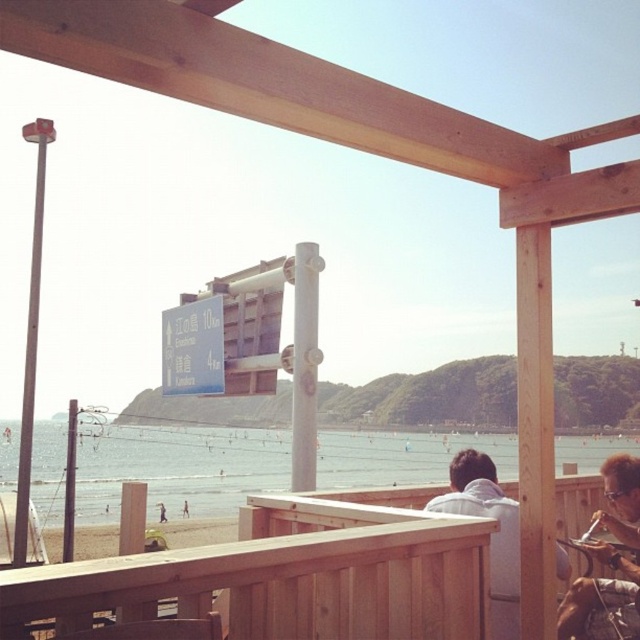
Question: Which point is farther from the camera taking this photo?

Choices:
 (A) (164, 522)
 (B) (502, 556)
 (C) (570, 632)
 (D) (252, 472)

Answer: (D)

Question: Can you confirm if white matte shirt at lower right is positioned below tan skin person at lower center?

Choices:
 (A) no
 (B) yes

Answer: (A)

Question: Which point is farther to the camera?

Choices:
 (A) (173, 488)
 (B) (611, 627)

Answer: (A)

Question: From the image, what is the correct spatial relationship of matte brown hair at upper right in relation to white matte shirt at lower right?

Choices:
 (A) above
 (B) below

Answer: (B)

Question: Does white matte shirt at lower right have a lesser width compared to tan skin person at lower center?

Choices:
 (A) yes
 (B) no

Answer: (B)

Question: Considering the real-world distances, which object is farthest from the tan skin person at lower center?

Choices:
 (A) dark brown wooden bench at lower center
 (B) matte brown hair at upper right

Answer: (B)